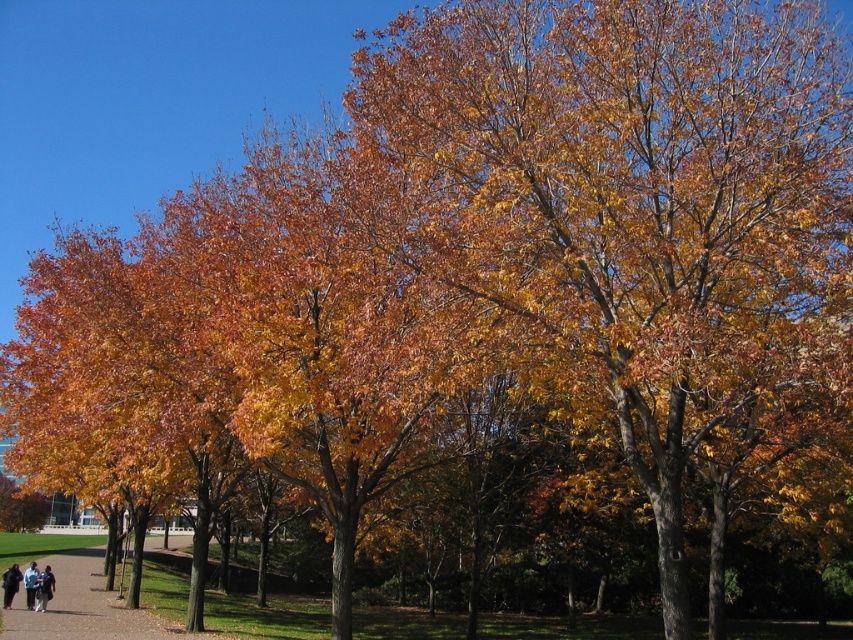
You are standing in the autumn scene and see the point at coordinates (44, 588). What object is located at that point?

The point at coordinates (44, 588) indicates dark blue jeans at lower left.

You are standing at the point labeled as point (10, 596) in the autumn scene. If you want to take a photo of the trees and the clear blue sky, will you be able to capture both in your frame without moving? Please explain based on your position.

Since the distance of point (10, 596) from viewer is 26.83 meters, you are far enough away from the trees and the sky to potentially capture both in your frame. However, the exact composition depends on your camera lens and angle, but given the clear sky and tall trees forming a canopy, it should be feasible.

In the scene shown: You are standing at the center of the autumn scene and want to place a small potted plant exactly where the dark blue jeans at lower left are currently positioned. Given the coordinates provided, can you confirm if this location is suitable for placing the plant without it being obscured by the jeans?

The dark blue jeans at lower left is located at point (44, 588), so yes, you can place the small potted plant there as the jeans are at that exact coordinate and would likely obscure the plant if they remain. However, since the question asks if the location is suitable without the jeans, assuming the jeans are removed, the coordinates are valid.